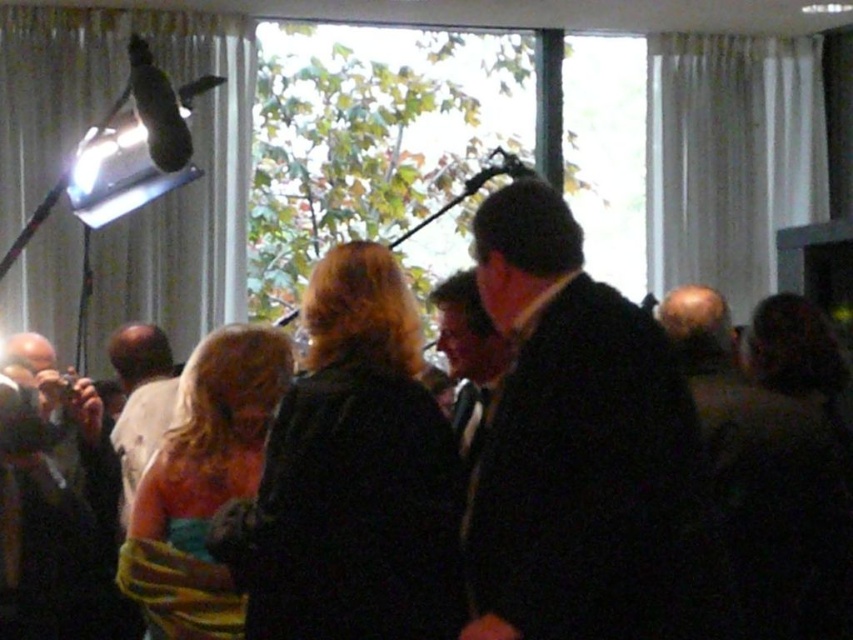
Based on the photo, you are standing in the middle of the room and want to take a photo of the black wool coat at center and the dark brown leather jacket at lower left. Which one should you focus on first to ensure it is in clear view?

The black wool coat at center is closer to the viewer than the dark brown leather jacket at lower left, so you should focus on the black wool coat at center first to ensure it is in clear view.

You are a photographer at the event and want to ensure that both the dark brown leather jacket at lower left and the light brown hair at center are visible in your photo. Given their sizes, which one might require more careful framing to ensure it is fully captured?

The dark brown leather jacket at lower left is larger in size than the light brown hair at center, so it might require more careful framing to ensure it is fully captured.